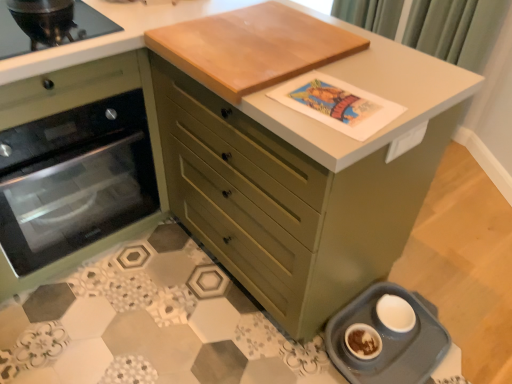
Locate an element on the screen. This screenshot has width=512, height=384. free spot to the right of gray plastic pet feeder at lower right is located at coordinates (475, 322).